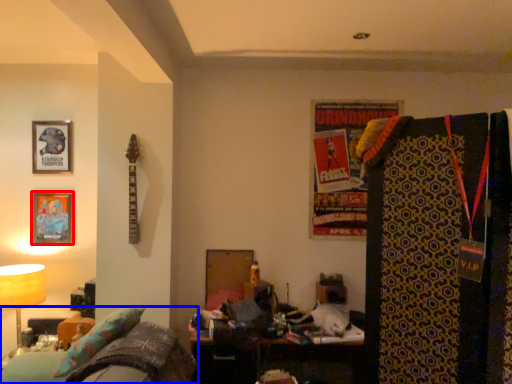
Question: Which object appears farthest to the camera in this image, picture frame (highlighted by a red box) or furniture (highlighted by a blue box)?

Choices:
 (A) picture frame
 (B) furniture

Answer: (A)